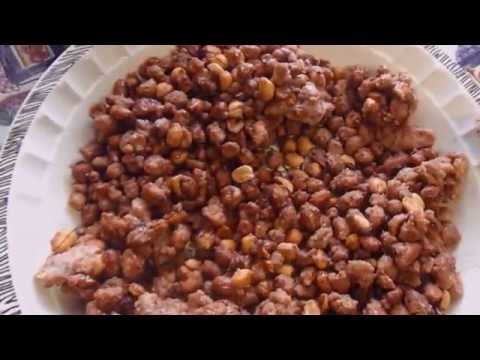
The width and height of the screenshot is (480, 360). In order to click on white plate in this screenshot , I will do `click(477, 222)`.